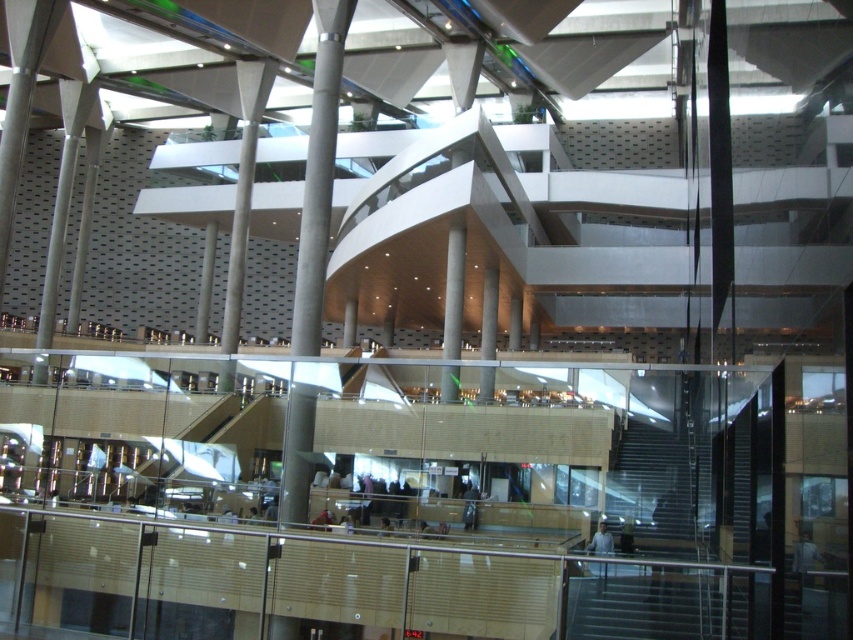
Can you confirm if concrete column at center is thinner than smooth concrete pillar at center?

No.

Does concrete column at center appear on the left side of smooth concrete pillar at center?

Correct, you'll find concrete column at center to the left of smooth concrete pillar at center.

Locate an element on the screen. concrete column at center is located at coordinates click(x=318, y=176).

Identify the location of concrete column at center. (318, 176).

Describe the element at coordinates (453, 291) in the screenshot. This screenshot has height=640, width=853. I see `smooth concrete pillar at center` at that location.

Measure the distance between smooth concrete pillar at center and satin gray column at center.

3.37 meters

What do you see at coordinates (453, 291) in the screenshot? I see `smooth concrete pillar at center` at bounding box center [453, 291].

Identify the location of smooth concrete pillar at center. (453, 291).